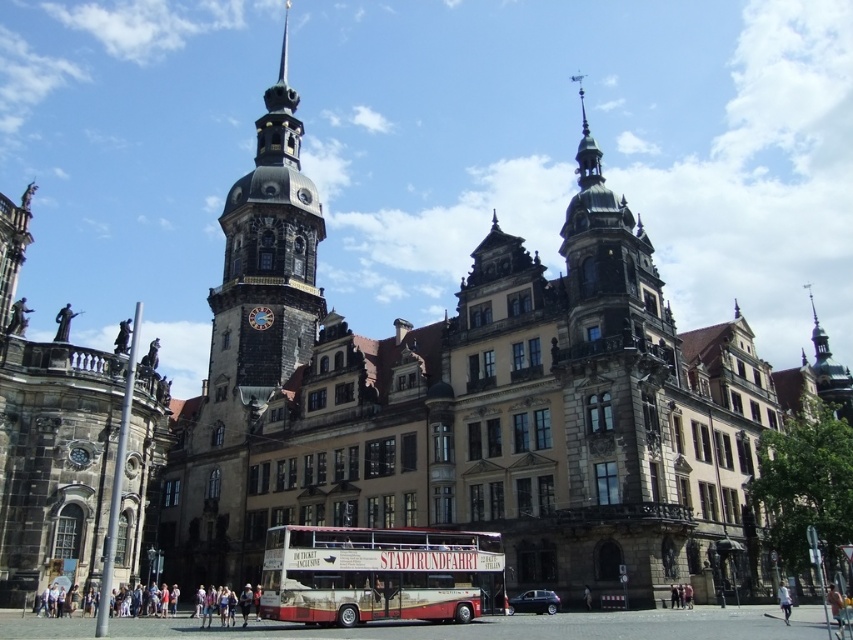
You are an architect analyzing the building in the image. You need to compare the widths of the dark gray stone tower at upper center and the red painted wood decker bus at center. Which one is wider?

The dark gray stone tower at upper center is wider than the red painted wood decker bus at center according to the description.